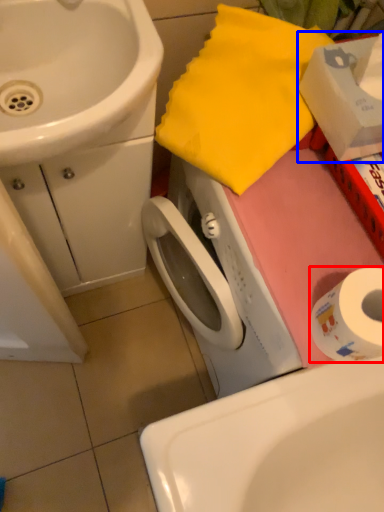
Question: Among these objects, which one is nearest to the camera, toilet paper (highlighted by a red box) or box (highlighted by a blue box)?

Choices:
 (A) toilet paper
 (B) box

Answer: (B)